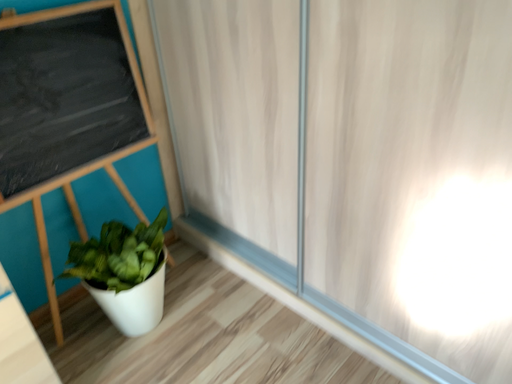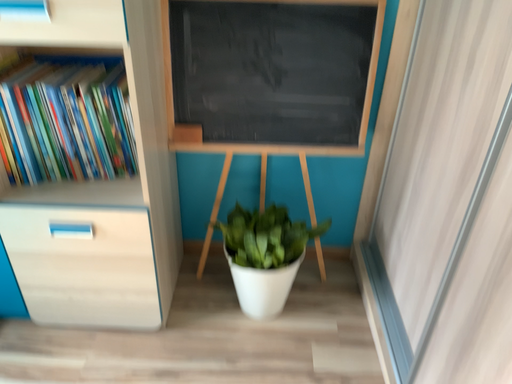
Question: Which way did the camera rotate in the video?

Choices:
 (A) rotated downward
 (B) rotated upward

Answer: (B)